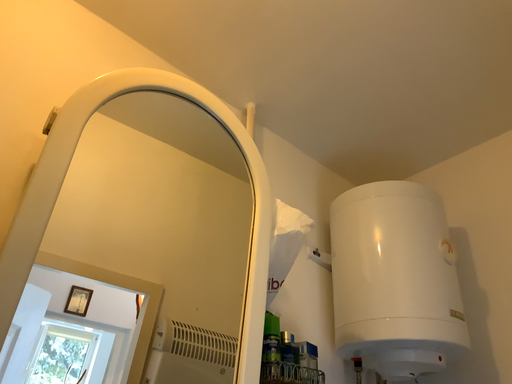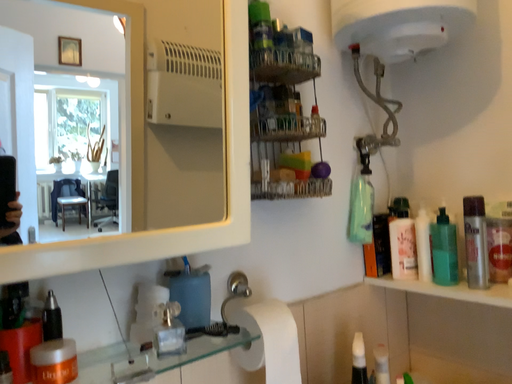
Question: How did the camera likely rotate when shooting the video?

Choices:
 (A) rotated downward
 (B) rotated upward

Answer: (A)